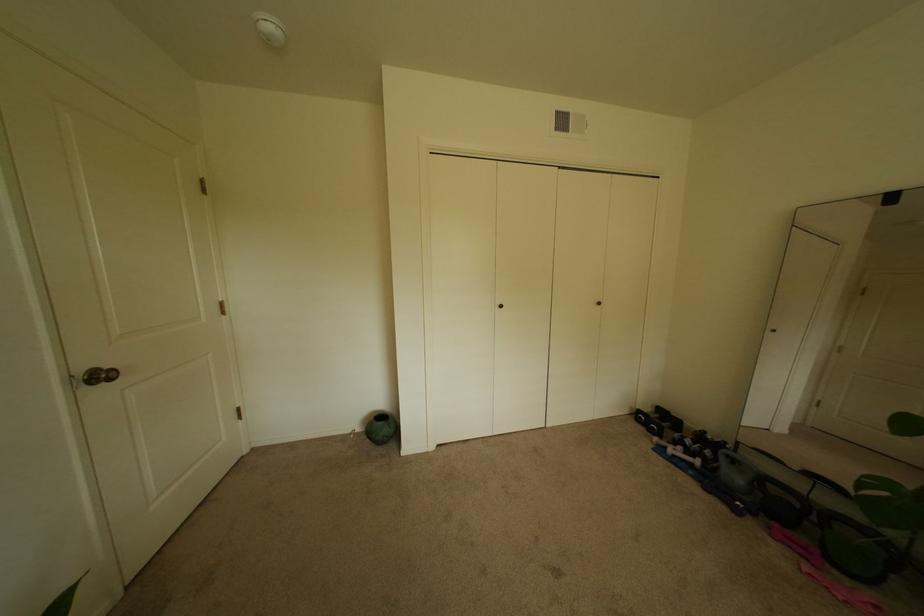
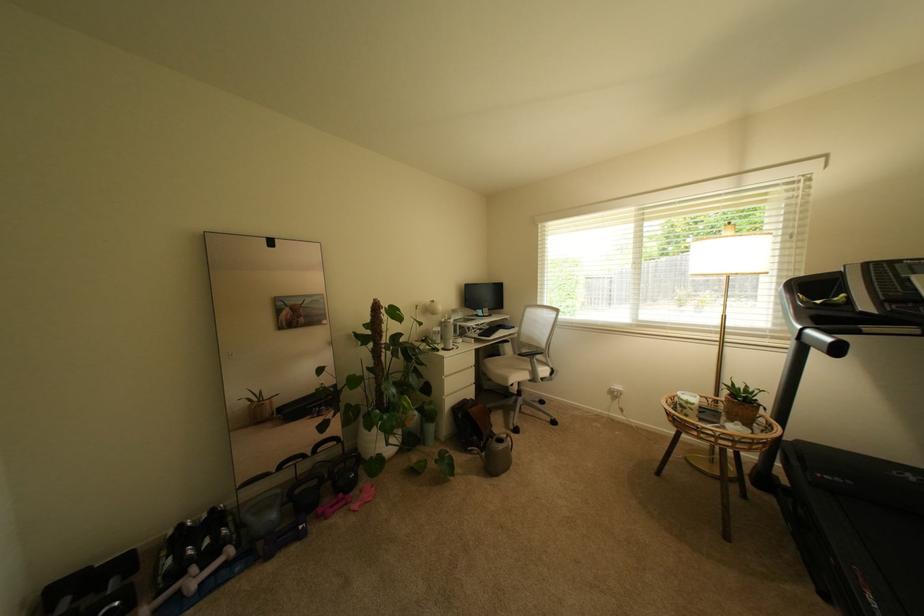
Locate, in the second image, the point that corresponds to (664,429) in the first image.

(126, 604)